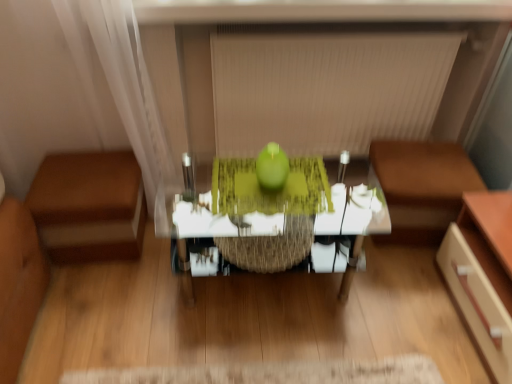
Where is `blank space above brown leather ottoman at left, which is the 2th furniture from right to left (from a real-world perspective)`? blank space above brown leather ottoman at left, which is the 2th furniture from right to left (from a real-world perspective) is located at coordinates point(83,175).